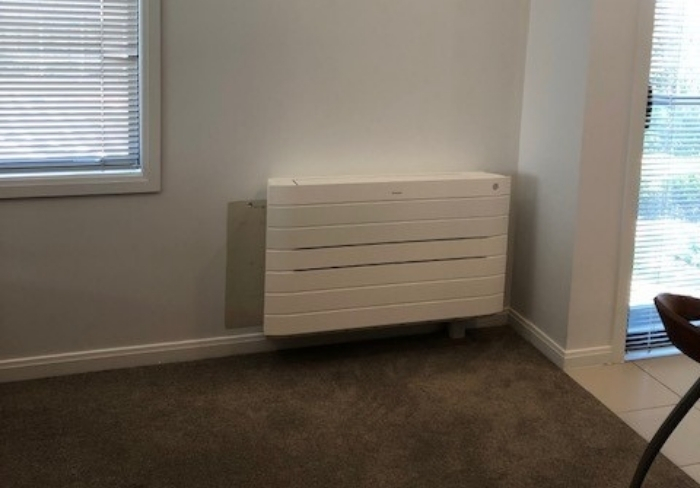
You are a GUI agent. You are given a task and a screenshot of the screen. Output one action in this format:
    pyautogui.click(x=<x>, y=<y>)
    Task: Click on the white, tiled floor
    The width and height of the screenshot is (700, 488).
    Given the screenshot: What is the action you would take?
    pyautogui.click(x=637, y=382)